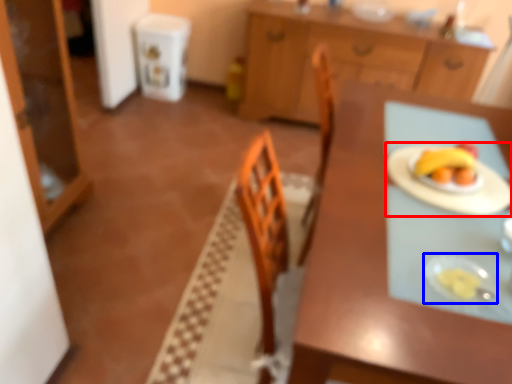
Question: Which point is closer to the camera, paper plate (highlighted by a red box) or tableware (highlighted by a blue box)?

Choices:
 (A) paper plate
 (B) tableware

Answer: (B)